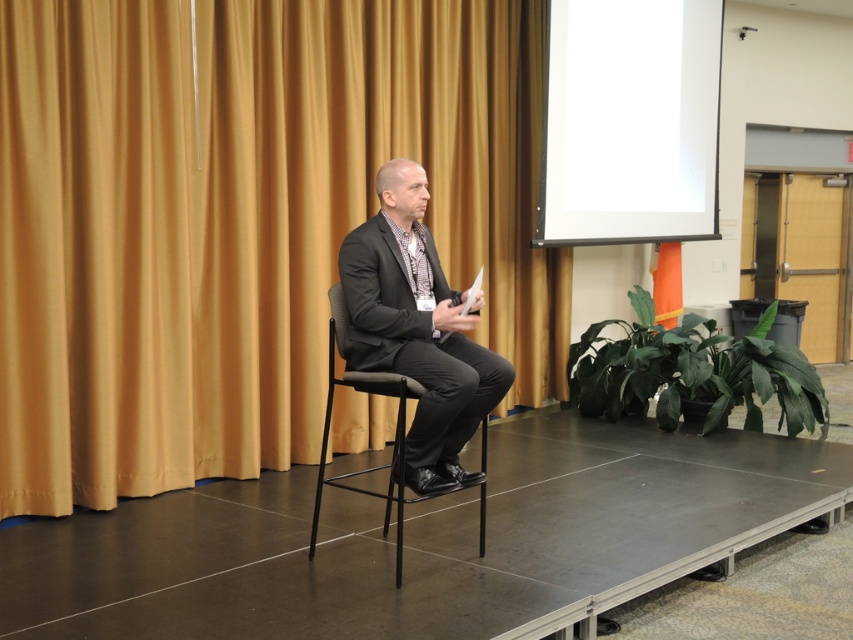
Question: In this image, where is matte black suit at center located relative to black mesh chair at center?

Choices:
 (A) right
 (B) left

Answer: (A)

Question: Estimate the real-world distances between objects in this image. Which object is closer to the white glossy projection screen at upper right?

Choices:
 (A) black mesh chair at center
 (B) matte black suit at center

Answer: (B)

Question: Where is matte black suit at center located in relation to black mesh chair at center in the image?

Choices:
 (A) right
 (B) left

Answer: (A)

Question: Considering the real-world distances, which object is closest to the black mesh chair at center?

Choices:
 (A) matte black suit at center
 (B) white glossy projection screen at upper right

Answer: (A)

Question: From the image, what is the correct spatial relationship of matte black suit at center in relation to black mesh chair at center?

Choices:
 (A) below
 (B) above

Answer: (B)

Question: Which object appears closest to the camera in this image?

Choices:
 (A) matte black suit at center
 (B) black mesh chair at center
 (C) white glossy projection screen at upper right

Answer: (B)